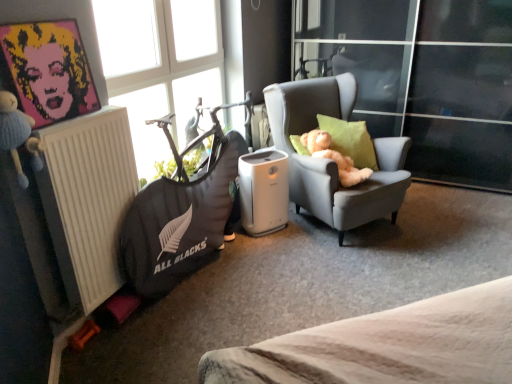
Question: Is pop art portrait of marilyn monroe at upper left located within green fabric pillow at right?

Choices:
 (A) no
 (B) yes

Answer: (A)

Question: Can you confirm if green fabric pillow at right is shorter than pop art portrait of marilyn monroe at upper left?

Choices:
 (A) no
 (B) yes

Answer: (B)

Question: Is green fabric pillow at right facing away from pop art portrait of marilyn monroe at upper left?

Choices:
 (A) yes
 (B) no

Answer: (B)

Question: Is green fabric pillow at right in front of pop art portrait of marilyn monroe at upper left?

Choices:
 (A) yes
 (B) no

Answer: (B)

Question: From a real-world perspective, does green fabric pillow at right stand above pop art portrait of marilyn monroe at upper left?

Choices:
 (A) yes
 (B) no

Answer: (B)

Question: From the image's perspective, is green fabric pillow at right located beneath pop art portrait of marilyn monroe at upper left?

Choices:
 (A) no
 (B) yes

Answer: (B)

Question: Can you confirm if pop art portrait of marilyn monroe at upper left is positioned to the right of dark gray fabric bean bag at left?

Choices:
 (A) no
 (B) yes

Answer: (A)

Question: Can you confirm if pop art portrait of marilyn monroe at upper left is bigger than dark gray fabric bean bag at left?

Choices:
 (A) no
 (B) yes

Answer: (A)

Question: Is pop art portrait of marilyn monroe at upper left shorter than dark gray fabric bean bag at left?

Choices:
 (A) no
 (B) yes

Answer: (B)

Question: Can dark gray fabric bean bag at left be found inside pop art portrait of marilyn monroe at upper left?

Choices:
 (A) no
 (B) yes

Answer: (A)

Question: Is pop art portrait of marilyn monroe at upper left further to the viewer compared to dark gray fabric bean bag at left?

Choices:
 (A) yes
 (B) no

Answer: (B)

Question: Is pop art portrait of marilyn monroe at upper left wider than dark gray fabric bean bag at left?

Choices:
 (A) no
 (B) yes

Answer: (A)

Question: Is white matte radiator at left positioned before transparent glass window at upper left?

Choices:
 (A) no
 (B) yes

Answer: (B)